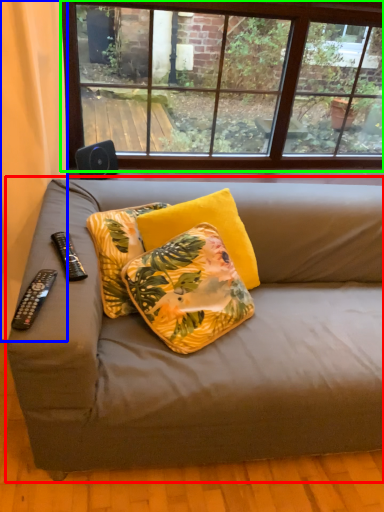
Question: Estimate the real-world distances between objects in this image. Which object is closer to studio couch (highlighted by a red box), curtain (highlighted by a blue box) or window (highlighted by a green box)?

Choices:
 (A) curtain
 (B) window

Answer: (A)